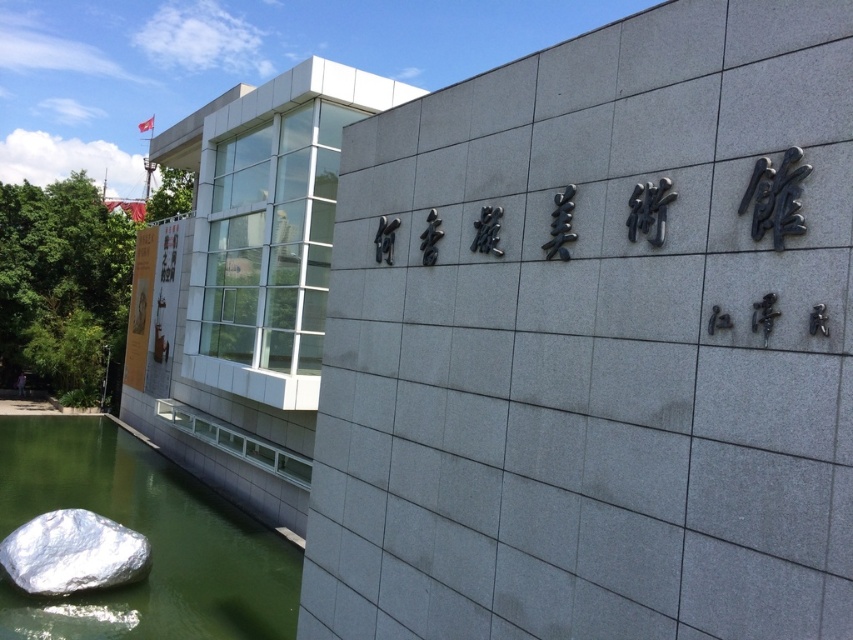
You are standing at the entrance of the building and notice the green reflective water at lower left and the shiny metallic rock at lower left. If you want to place a small decorative pot between them, will there be enough space?

The green reflective water at lower left and the shiny metallic rock at lower left are 6.34 feet apart from each other, so there is sufficient space to place a small decorative pot between them.

You are standing in front of the modern building and see the green reflective water at lower left and the shiny metallic rock at lower left. Which object is nearer to you?

The green reflective water at lower left is closer to the viewer than the shiny metallic rock at lower left.